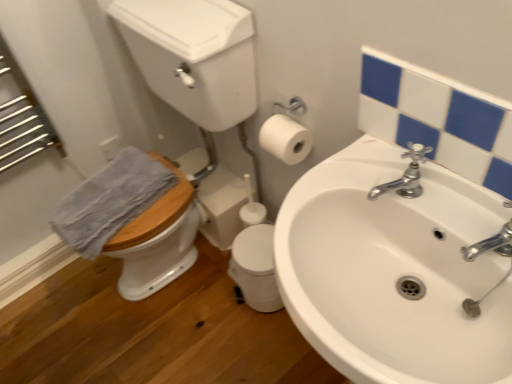
At what (x,y) coordinates should I click in order to perform the action: click on vacant area that is situated to the right of silver metallic faucet at upper right. Please return your answer as a coordinate pair (x, y). The image size is (512, 384). Looking at the image, I should click on (447, 204).